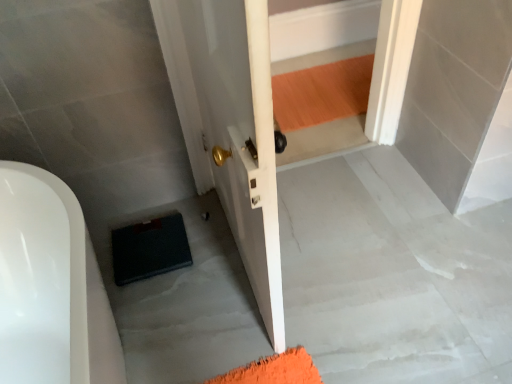
Locate an element on the screen. Image resolution: width=512 pixels, height=384 pixels. free space above dark blue rubber mat at lower left (from a real-world perspective) is located at coordinates pos(150,243).